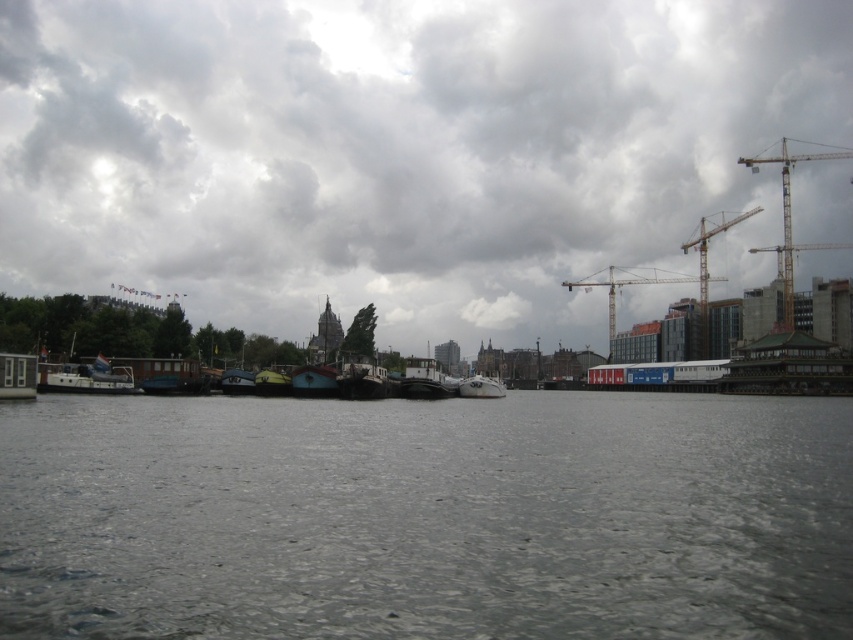
The width and height of the screenshot is (853, 640). What do you see at coordinates (426, 516) in the screenshot?
I see `gray water at center` at bounding box center [426, 516].

Measure the distance between gray water at center and teal glossy boat at center.

gray water at center and teal glossy boat at center are 29.86 meters apart.

You are a GUI agent. You are given a task and a screenshot of the screen. Output one action in this format:
    pyautogui.click(x=<x>, y=<y>)
    Task: Click on the gray water at center
    This screenshot has width=853, height=640.
    Given the screenshot: What is the action you would take?
    pyautogui.click(x=426, y=516)

The image size is (853, 640). I want to click on gray water at center, so [426, 516].

In the scene shown: Is metallic construction crane at upper right above wooden boat at center?

Correct, metallic construction crane at upper right is located above wooden boat at center.

Which is behind, point (585, 285) or point (354, 394)?

Positioned behind is point (585, 285).

Image resolution: width=853 pixels, height=640 pixels. What are the coordinates of `metallic construction crane at upper right` in the screenshot? It's located at (621, 285).

Identify the location of metallic construction crane at upper right. The image size is (853, 640). (621, 285).

Does metallic construction crane at upper right have a greater height compared to white matte boat at center?

Correct, metallic construction crane at upper right is much taller as white matte boat at center.

Does metallic construction crane at upper right have a larger size compared to white matte boat at center?

Yes, metallic construction crane at upper right is bigger than white matte boat at center.

Image resolution: width=853 pixels, height=640 pixels. What do you see at coordinates (621, 285) in the screenshot?
I see `metallic construction crane at upper right` at bounding box center [621, 285].

This screenshot has width=853, height=640. Find the location of `metallic construction crane at upper right`. metallic construction crane at upper right is located at coordinates (621, 285).